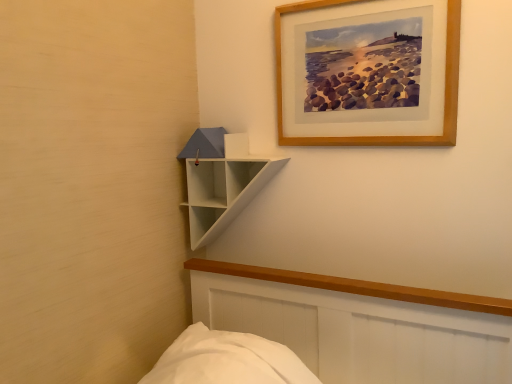
Question: From their relative heights in the image, would you say wooden picture frame at upper right is taller or shorter than white matte shelf at upper left?

Choices:
 (A) tall
 (B) short

Answer: (A)

Question: Is point (282, 91) positioned closer to the camera than point (214, 163)?

Choices:
 (A) farther
 (B) closer

Answer: (B)

Question: From the image's perspective, is wooden picture frame at upper right located above or below white matte shelf at upper left?

Choices:
 (A) below
 (B) above

Answer: (B)

Question: In terms of height, does white matte shelf at upper left look taller or shorter compared to wooden picture frame at upper right?

Choices:
 (A) tall
 (B) short

Answer: (B)

Question: Does point (189, 160) appear closer or farther from the camera than point (448, 34)?

Choices:
 (A) farther
 (B) closer

Answer: (A)

Question: Is white matte shelf at upper left wider or thinner than wooden picture frame at upper right?

Choices:
 (A) wide
 (B) thin

Answer: (A)

Question: From the image's perspective, relative to wooden picture frame at upper right, is white matte shelf at upper left above or below?

Choices:
 (A) above
 (B) below

Answer: (B)